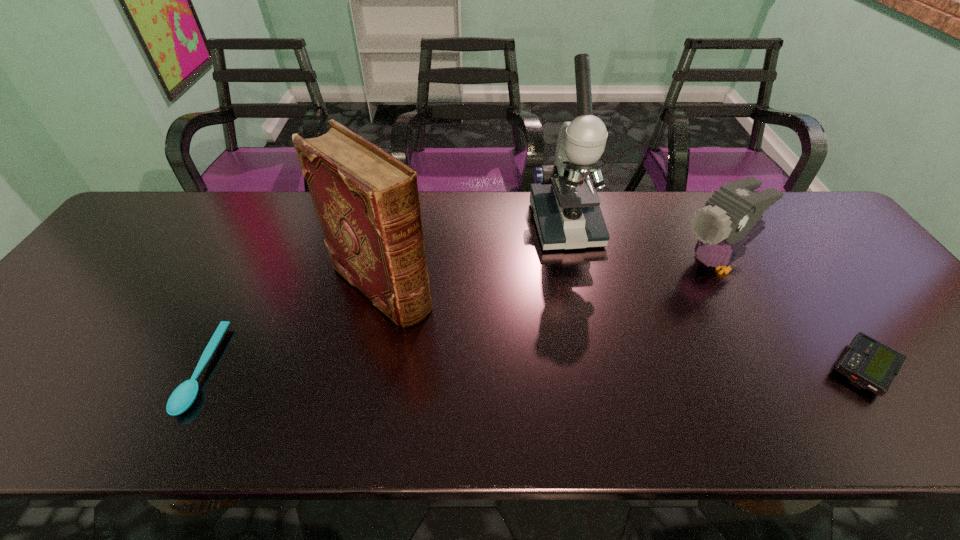
Image resolution: width=960 pixels, height=540 pixels. Find the location of `vacant space positioned on the back of the fourth tallest object`. vacant space positioned on the back of the fourth tallest object is located at coordinates (769, 235).

At what (x,y) coordinates should I click in order to perform the action: click on vacant space situated 0.300m on the spine side of the hardback book. Please return your answer as a coordinate pair (x, y). Looking at the image, I should click on (507, 393).

Locate an element on the screen. This screenshot has height=540, width=960. vacant space located on the spine side of the hardback book is located at coordinates (476, 367).

Identify the location of vacant space situated 0.120m on the spine side of the hardback book. Image resolution: width=960 pixels, height=540 pixels. (449, 343).

Locate an element on the screen. The height and width of the screenshot is (540, 960). free space located 0.180m at the beak of the third tallest object is located at coordinates (632, 305).

Locate an element on the screen. vacant position located at the beak of the third tallest object is located at coordinates (620, 311).

Locate an element on the screen. This screenshot has height=540, width=960. vacant space located at the beak of the third tallest object is located at coordinates (660, 288).

Where is `free spot located 0.070m at the eyepiece of the third object from left to right`? The width and height of the screenshot is (960, 540). free spot located 0.070m at the eyepiece of the third object from left to right is located at coordinates (581, 271).

Find the location of a particular element. vacant space located 0.350m at the eyepiece of the third object from left to right is located at coordinates (x=612, y=358).

Find the location of `free space located at the eyepiece of the third object from left to right`. free space located at the eyepiece of the third object from left to right is located at coordinates (599, 323).